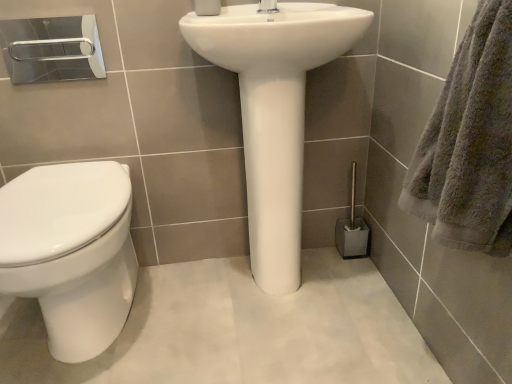
Identify the location of free spot below white glossy toilet at left (from a real-world perspective). The image size is (512, 384). (84, 347).